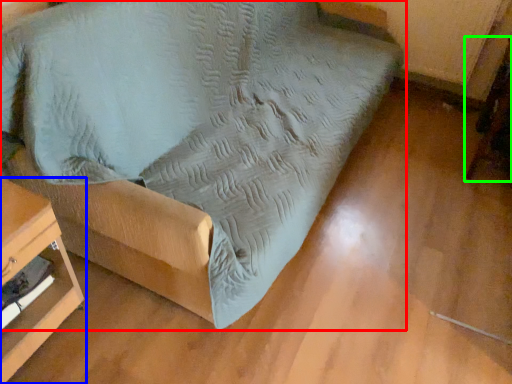
Question: Which object is positioned closest to furniture (highlighted by a red box)? Select from furniture (highlighted by a blue box) and swivel chair (highlighted by a green box).

Choices:
 (A) furniture
 (B) swivel chair

Answer: (A)